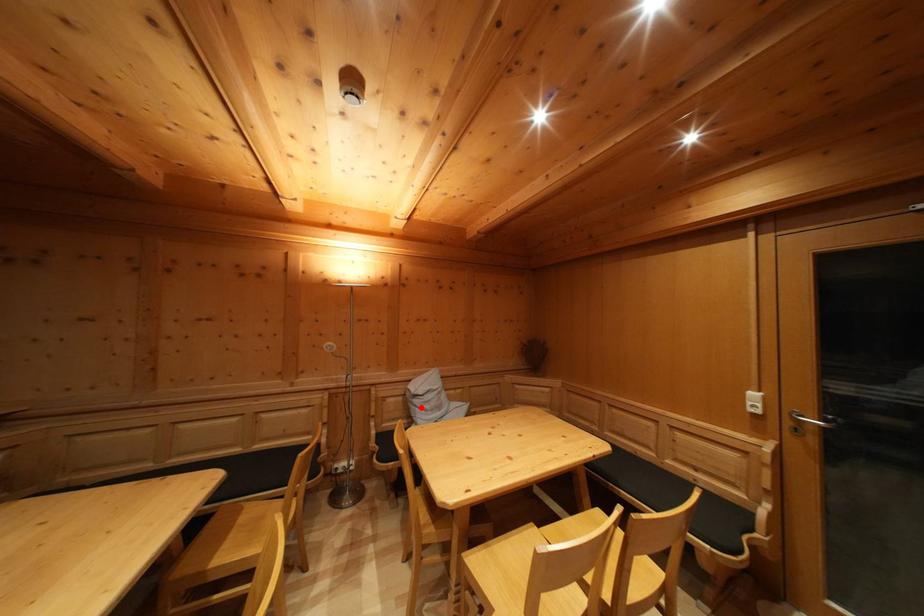
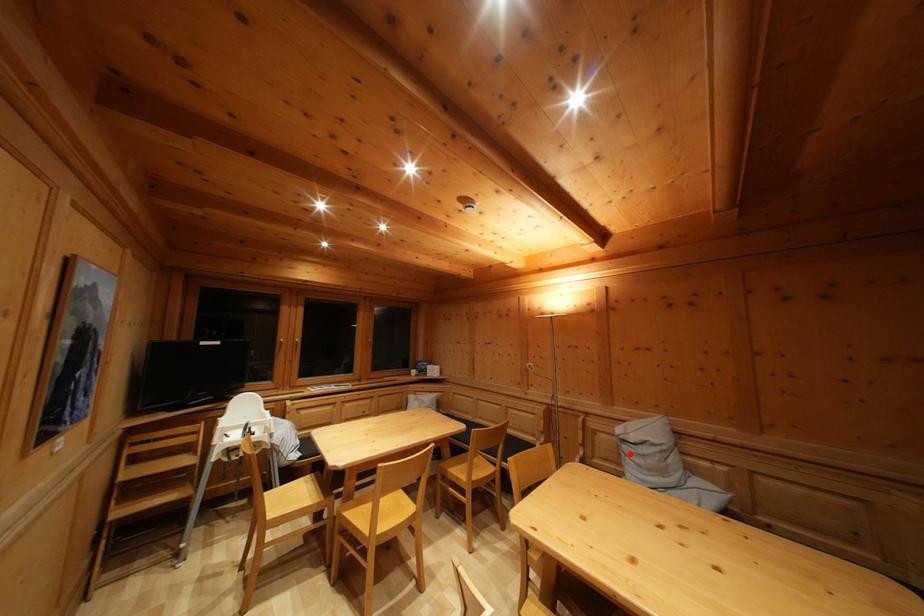
I am providing you with two images of the same scene from different viewpoints. A red point is marked on the first image and another point is marked on the second image. Does the point marked in image1 correspond to the same location as the one in image2?

Yes